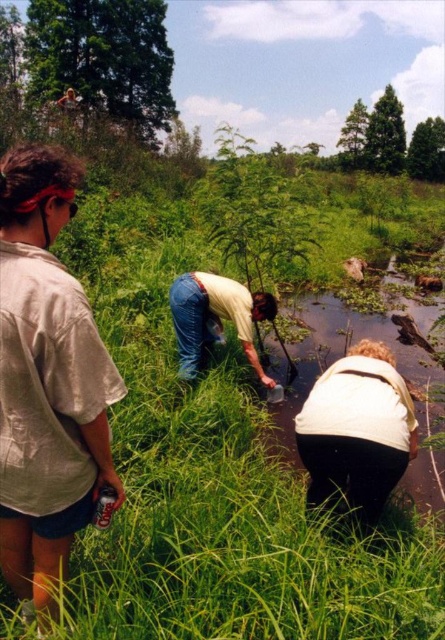
Question: Considering the relative positions of green grass at center and blue jeans at center in the image provided, where is green grass at center located with respect to blue jeans at center?

Choices:
 (A) above
 (B) below

Answer: (B)

Question: Which of these objects is positioned farthest from the green grass at center?

Choices:
 (A) white cotton shirt at left
 (B) blue jeans at center
 (C) white matte shirt at lower right

Answer: (B)

Question: Considering the relative positions of green grass at center and blue jeans at center in the image provided, where is green grass at center located with respect to blue jeans at center?

Choices:
 (A) left
 (B) right

Answer: (A)

Question: Which of the following is the farthest from the observer?

Choices:
 (A) (45, 216)
 (B) (296, 413)

Answer: (B)

Question: Estimate the real-world distances between objects in this image. Which object is farther from the white matte shirt at lower right?

Choices:
 (A) white cotton shirt at left
 (B) green grass at center

Answer: (A)

Question: Does white cotton shirt at left have a smaller size compared to blue jeans at center?

Choices:
 (A) no
 (B) yes

Answer: (B)